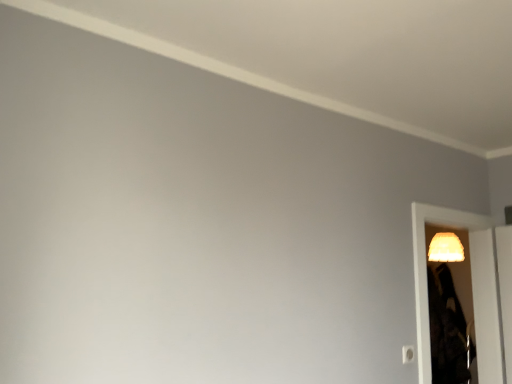
You are a GUI agent. You are given a task and a screenshot of the screen. Output one action in this format:
    pyautogui.click(x=<x>, y=<y>)
    Task: Click on the translucent plastic screen door at right
    
    Given the screenshot: What is the action you would take?
    472,288

The height and width of the screenshot is (384, 512). What do you see at coordinates (446, 248) in the screenshot? I see `matte yellow lampshade at right` at bounding box center [446, 248].

Looking at this image, in order to face white plastic light switch at lower right, should I rotate leftwards or rightwards?

Turn right approximately 20.138 degrees to face it.

Image resolution: width=512 pixels, height=384 pixels. Find the location of `translucent plastic screen door at right`. translucent plastic screen door at right is located at coordinates (472, 288).

Where is `screen door below the matte yellow lampshade at right (from the image's perspective)`? screen door below the matte yellow lampshade at right (from the image's perspective) is located at coordinates (472, 288).

Does matte yellow lampshade at right have a lesser height compared to translucent plastic screen door at right?

Yes.

Where is `light switch that is on the left side of translucent plastic screen door at right`? light switch that is on the left side of translucent plastic screen door at right is located at coordinates (408, 354).

Between point (481, 381) and point (410, 354), which one is positioned behind?

The point (481, 381) is farther.

Looking at this image, from the image's perspective, relative to white plastic light switch at lower right, is translucent plastic screen door at right above or below?

Based on their image positions, translucent plastic screen door at right is located above white plastic light switch at lower right.

From a real-world perspective, is translucent plastic screen door at right above or below white plastic light switch at lower right?

translucent plastic screen door at right is above white plastic light switch at lower right.

Which is correct: translucent plastic screen door at right is inside matte yellow lampshade at right, or outside of it?

translucent plastic screen door at right exists outside the volume of matte yellow lampshade at right.

Considering the positions of objects translucent plastic screen door at right and matte yellow lampshade at right in the image provided, who is in front, translucent plastic screen door at right or matte yellow lampshade at right?

translucent plastic screen door at right is more forward.

Where is `screen door that is in front of the matte yellow lampshade at right`? This screenshot has height=384, width=512. screen door that is in front of the matte yellow lampshade at right is located at coordinates coord(472,288).

Considering the sizes of objects white plastic light switch at lower right and matte yellow lampshade at right in the image provided, who is wider, white plastic light switch at lower right or matte yellow lampshade at right?

matte yellow lampshade at right.

Does white plastic light switch at lower right come behind matte yellow lampshade at right?

That is False.

Is white plastic light switch at lower right oriented away from matte yellow lampshade at right?

white plastic light switch at lower right is not turned away from matte yellow lampshade at right.

Where is `light switch below the matte yellow lampshade at right (from the image's perspective)`? This screenshot has width=512, height=384. light switch below the matte yellow lampshade at right (from the image's perspective) is located at coordinates pyautogui.click(x=408, y=354).

Is matte yellow lampshade at right facing towards white plastic light switch at lower right?

No.

Where is `light switch below the matte yellow lampshade at right (from the image's perspective)`? The image size is (512, 384). light switch below the matte yellow lampshade at right (from the image's perspective) is located at coordinates (408, 354).

Is matte yellow lampshade at right far from white plastic light switch at lower right?

matte yellow lampshade at right is far away from white plastic light switch at lower right.

What's the angular difference between matte yellow lampshade at right and white plastic light switch at lower right's facing directions?

matte yellow lampshade at right and white plastic light switch at lower right are facing 94.6 degrees away from each other.

Consider the image. Is white plastic light switch at lower right in front of or behind translucent plastic screen door at right in the image?

In the image, white plastic light switch at lower right appears in front of translucent plastic screen door at right.

Would you say translucent plastic screen door at right is part of white plastic light switch at lower right's contents?

Definitely not — translucent plastic screen door at right is not inside white plastic light switch at lower right.

From a real-world perspective, is white plastic light switch at lower right below translucent plastic screen door at right?

Answer: Yes.

From the image's perspective, would you say white plastic light switch at lower right is shown under translucent plastic screen door at right?

Indeed, from the image's perspective, white plastic light switch at lower right is shown beneath translucent plastic screen door at right.

Image resolution: width=512 pixels, height=384 pixels. In the image, there is a matte yellow lampshade at right. Find the location of `screen door below it (from the image's perspective)`. screen door below it (from the image's perspective) is located at coordinates (472, 288).

The width and height of the screenshot is (512, 384). I want to click on light switch on the left of translucent plastic screen door at right, so click(x=408, y=354).

Looking at the image, which one is located closer to white plastic light switch at lower right, translucent plastic screen door at right or matte yellow lampshade at right?

The object closer to white plastic light switch at lower right is translucent plastic screen door at right.

From the image, which object appears to be farther from matte yellow lampshade at right, translucent plastic screen door at right or white plastic light switch at lower right?

Based on the image, white plastic light switch at lower right appears to be further to matte yellow lampshade at right.

Based on their spatial positions, is white plastic light switch at lower right or matte yellow lampshade at right further from translucent plastic screen door at right?

white plastic light switch at lower right.

From the picture: Looking at the image, which one is located further to translucent plastic screen door at right, matte yellow lampshade at right or white plastic light switch at lower right?

white plastic light switch at lower right is positioned further to the anchor translucent plastic screen door at right.

Based on their spatial positions, is white plastic light switch at lower right or translucent plastic screen door at right further from matte yellow lampshade at right?

white plastic light switch at lower right lies further to matte yellow lampshade at right than the other object.

From the picture: Based on their spatial positions, is matte yellow lampshade at right or translucent plastic screen door at right further from white plastic light switch at lower right?

matte yellow lampshade at right is positioned further to the anchor white plastic light switch at lower right.

You are a GUI agent. You are given a task and a screenshot of the screen. Output one action in this format:
    pyautogui.click(x=<x>, y=<y>)
    Task: Click on the screen door positioned between white plastic light switch at lower right and matte yellow lampshade at right from near to far
    This screenshot has width=512, height=384.
    Given the screenshot: What is the action you would take?
    pyautogui.click(x=472, y=288)